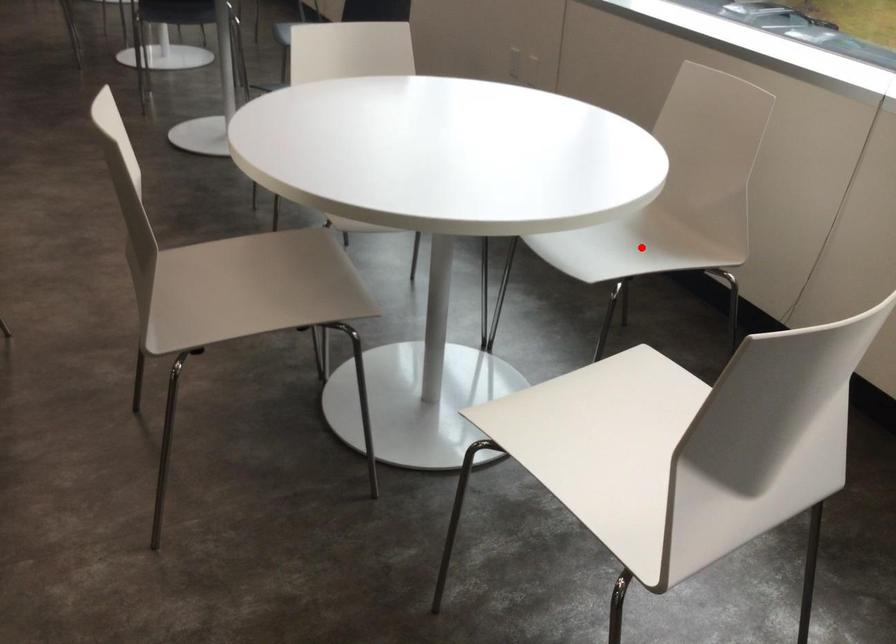
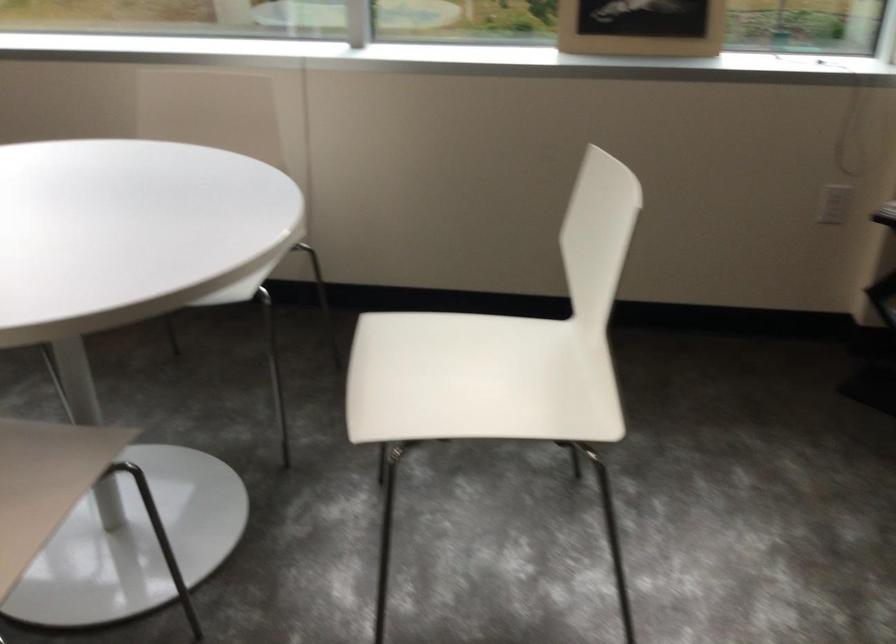
Question: I am providing you with two images of the same scene from different viewpoints. A red point is marked on the first image. Can you still see the location of the red point in image 2?

Choices:
 (A) Yes
 (B) No

Answer: (B)